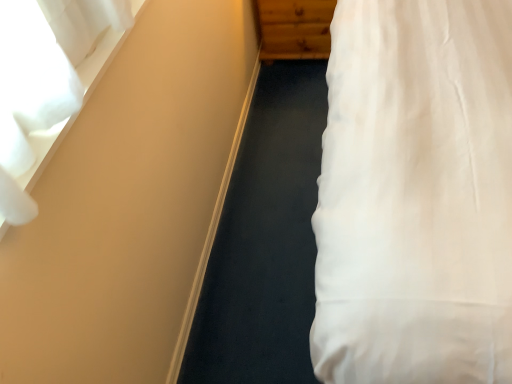
Identify the location of wooden dresser at upper center. (295, 28).

What do you see at coordinates (295, 28) in the screenshot? I see `wooden dresser at upper center` at bounding box center [295, 28].

I want to click on white sheer curtain at upper left, so click(48, 87).

What do you see at coordinates (48, 87) in the screenshot?
I see `white sheer curtain at upper left` at bounding box center [48, 87].

You are a GUI agent. You are given a task and a screenshot of the screen. Output one action in this format:
    pyautogui.click(x=<x>, y=<y>)
    Task: Click on the wooden dresser at upper center
    
    Given the screenshot: What is the action you would take?
    coord(295,28)

Considering the relative positions of wooden dresser at upper center and white sheer curtain at upper left in the image provided, is wooden dresser at upper center to the left of white sheer curtain at upper left from the viewer's perspective?

In fact, wooden dresser at upper center is to the right of white sheer curtain at upper left.

Is wooden dresser at upper center further to camera compared to white sheer curtain at upper left?

Yes, wooden dresser at upper center is further from the viewer.

Is point (297, 9) behind point (60, 50)?

Yes.

From the image's perspective, which one is positioned higher, wooden dresser at upper center or white sheer curtain at upper left?

From the image's view, wooden dresser at upper center is above.

From a real-world perspective, which is physically below, wooden dresser at upper center or white sheer curtain at upper left?

wooden dresser at upper center is physically lower.

Which of these two, wooden dresser at upper center or white sheer curtain at upper left, is thinner?

white sheer curtain at upper left.

Which of these two, wooden dresser at upper center or white sheer curtain at upper left, stands shorter?

With less height is white sheer curtain at upper left.

Is wooden dresser at upper center bigger than white sheer curtain at upper left?

Indeed, wooden dresser at upper center has a larger size compared to white sheer curtain at upper left.

Is white sheer curtain at upper left completely or partially inside wooden dresser at upper center?

No, wooden dresser at upper center does not contain white sheer curtain at upper left.

Is wooden dresser at upper center positioned far away from white sheer curtain at upper left?

Yes, wooden dresser at upper center and white sheer curtain at upper left are quite far apart.

Is wooden dresser at upper center turned away from white sheer curtain at upper left?

wooden dresser at upper center does not have its back to white sheer curtain at upper left.

Identify the location of curtain that is on the left side of wooden dresser at upper center. The width and height of the screenshot is (512, 384). (48, 87).

Considering the positions of objects white sheer curtain at upper left and wooden dresser at upper center in the image provided, who is more to the left, white sheer curtain at upper left or wooden dresser at upper center?

Positioned to the left is white sheer curtain at upper left.

In the image, is white sheer curtain at upper left positioned in front of or behind wooden dresser at upper center?

white sheer curtain at upper left is positioned closer to the viewer than wooden dresser at upper center.

Which is nearer, (56,86) or (301,47)?

The point (56,86) is closer to the camera.

From the image's perspective, is white sheer curtain at upper left on top of wooden dresser at upper center?

No, from the image's perspective, white sheer curtain at upper left is not on top of wooden dresser at upper center.

From a real-world perspective, is white sheer curtain at upper left physically below wooden dresser at upper center?

No.

In the scene shown: Does white sheer curtain at upper left have a greater width compared to wooden dresser at upper center?

No, white sheer curtain at upper left is not wider than wooden dresser at upper center.

Is white sheer curtain at upper left taller than wooden dresser at upper center?

In fact, white sheer curtain at upper left may be shorter than wooden dresser at upper center.

Is white sheer curtain at upper left bigger or smaller than wooden dresser at upper center?

Considering their sizes, white sheer curtain at upper left takes up less space than wooden dresser at upper center.

Is white sheer curtain at upper left spatially inside wooden dresser at upper center, or outside of it?

white sheer curtain at upper left lies outside wooden dresser at upper center.

Is white sheer curtain at upper left touching wooden dresser at upper center?

No, white sheer curtain at upper left is not next to wooden dresser at upper center.

Based on the photo, could you tell me if white sheer curtain at upper left is facing wooden dresser at upper center?

No, white sheer curtain at upper left is not aimed at wooden dresser at upper center.

How distant is white sheer curtain at upper left from wooden dresser at upper center?

The distance of white sheer curtain at upper left from wooden dresser at upper center is 4.73 feet.

This screenshot has height=384, width=512. What are the coordinates of `dresser behind the white sheer curtain at upper left` in the screenshot? It's located at (295, 28).

The height and width of the screenshot is (384, 512). I want to click on curtain lying on the left of wooden dresser at upper center, so click(x=48, y=87).

I want to click on dresser behind the white sheer curtain at upper left, so click(x=295, y=28).